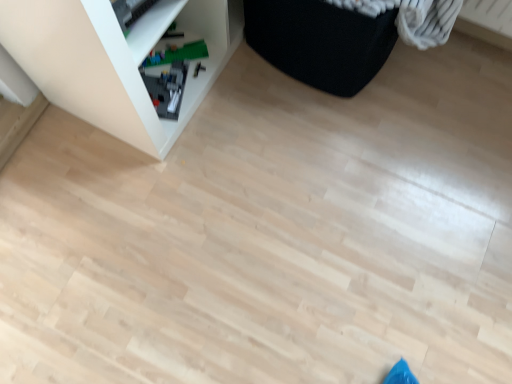
Where is `free location to the right of white plastic shelf at upper left`? The height and width of the screenshot is (384, 512). free location to the right of white plastic shelf at upper left is located at coordinates (287, 130).